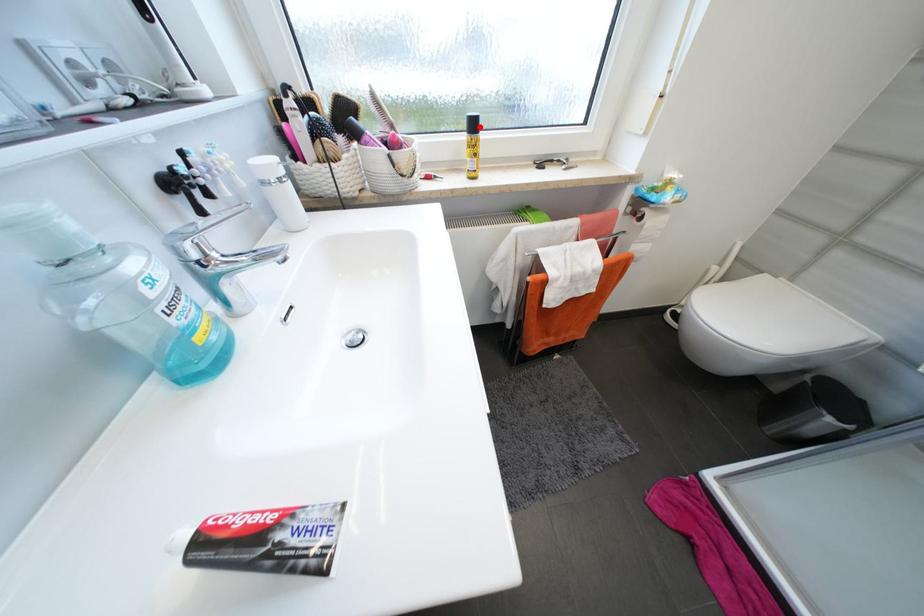
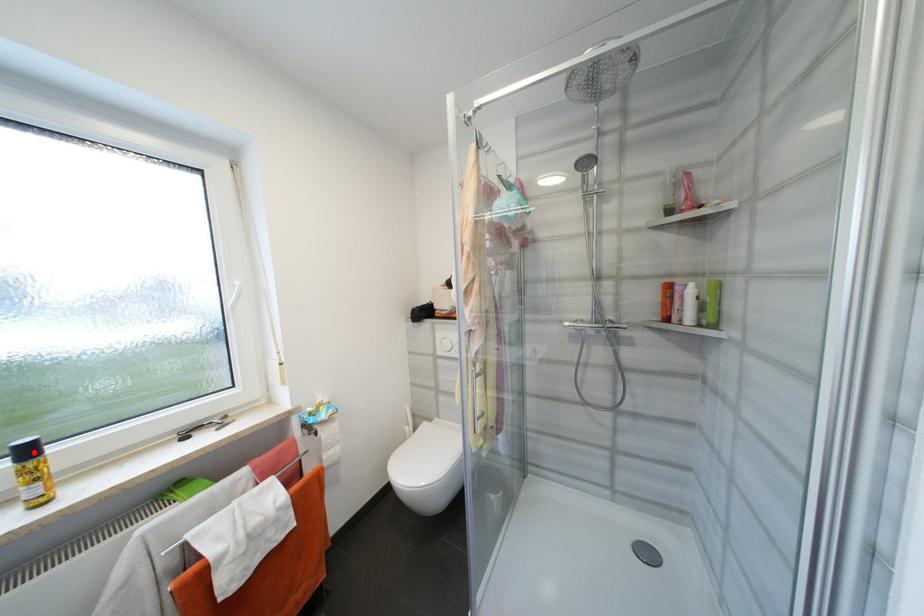
I am providing you with two images of the same scene from different viewpoints. A red point is marked on the first image and another point is marked on the second image. Are the points marked in image1 and image2 representing the same 3D position?

Yes